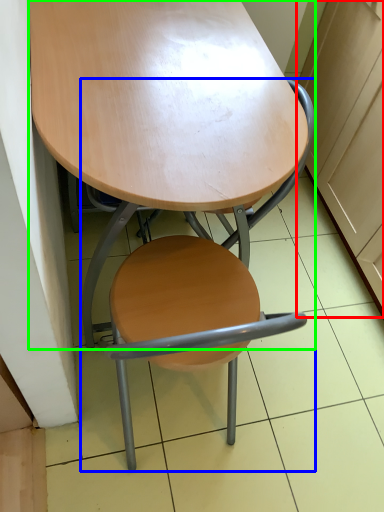
Question: Considering the real-world distances, which object is closest to cabinetry (highlighted by a red box)? chair (highlighted by a blue box) or table (highlighted by a green box).

Choices:
 (A) chair
 (B) table

Answer: (A)